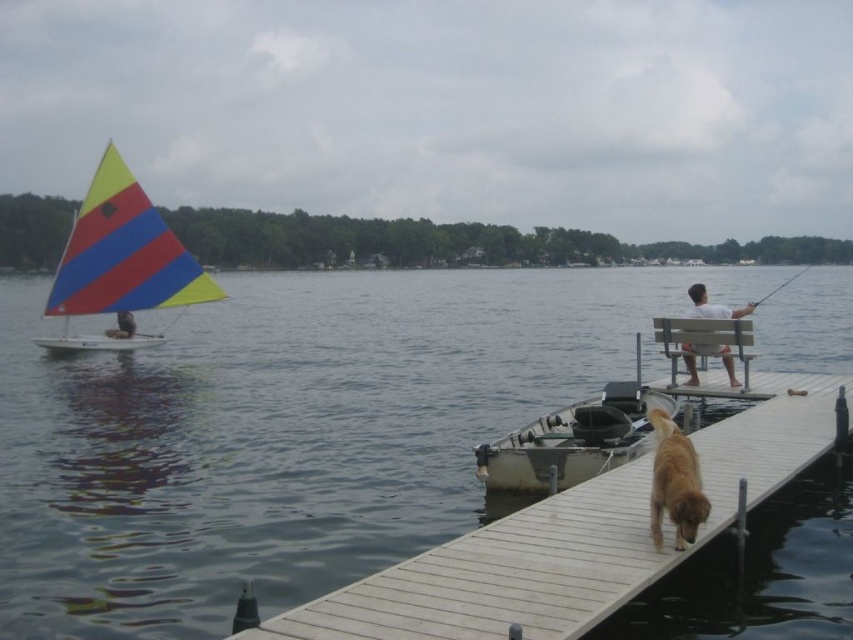
Question: Which object appears closest to the camera in this image?

Choices:
 (A) yellow and blue fabric sailboat at left
 (B) white wood bench at right
 (C) golden fur dog at lower right
 (D) smooth wooden fishing pole at right

Answer: (C)

Question: Which object appears farthest from the camera in this image?

Choices:
 (A) wooden dock at lower right
 (B) matte black sailboat at left

Answer: (B)

Question: Considering the relative positions of matte black sailboat at left and smooth wooden fishing pole at right in the image provided, where is matte black sailboat at left located with respect to smooth wooden fishing pole at right?

Choices:
 (A) right
 (B) left

Answer: (B)

Question: Is golden fur dog at lower right to the left of matte black sailboat at left from the viewer's perspective?

Choices:
 (A) yes
 (B) no

Answer: (B)

Question: Does wooden dock at lower right have a larger size compared to golden fur dog at lower right?

Choices:
 (A) yes
 (B) no

Answer: (A)

Question: Which object appears farthest from the camera in this image?

Choices:
 (A) matte black sailboat at left
 (B) wooden dock at lower right
 (C) smooth wooden fishing pole at right
 (D) white wood bench at right

Answer: (A)